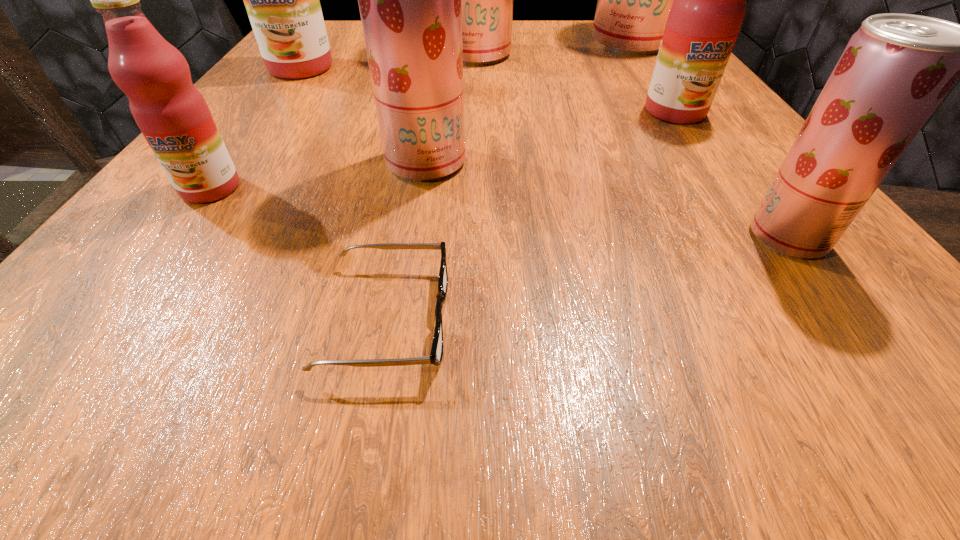
Where is `object situated at the near edge`? object situated at the near edge is located at coordinates (436, 355).

Where is `object situated at the far left corner`? The width and height of the screenshot is (960, 540). object situated at the far left corner is located at coordinates (282, 0).

Where is `object that is at the far right corner`? This screenshot has height=540, width=960. object that is at the far right corner is located at coordinates (634, 0).

This screenshot has width=960, height=540. What are the coordinates of `free region at the far edge of the desktop` in the screenshot? It's located at (554, 27).

What are the coordinates of `vacant area at the near edge of the desktop` in the screenshot? It's located at (642, 330).

The width and height of the screenshot is (960, 540). I want to click on vacant space at the left edge of the desktop, so click(x=179, y=317).

You are a GUI agent. You are given a task and a screenshot of the screen. Output one action in this format:
    pyautogui.click(x=<x>, y=<y>)
    Task: Click on the free spot at the right edge of the desktop
    
    Given the screenshot: What is the action you would take?
    pyautogui.click(x=732, y=206)

In the image, there is a desktop. Where is `blank space at the far left corner`? Image resolution: width=960 pixels, height=540 pixels. blank space at the far left corner is located at coordinates (355, 28).

Find the location of a particular element. This screenshot has width=960, height=540. unoccupied position between the smallest pink fruit juice and the farthest pink fruit juice is located at coordinates (255, 128).

This screenshot has width=960, height=540. I want to click on free spot between the nearest pink fruit juice and the spectacles, so click(300, 253).